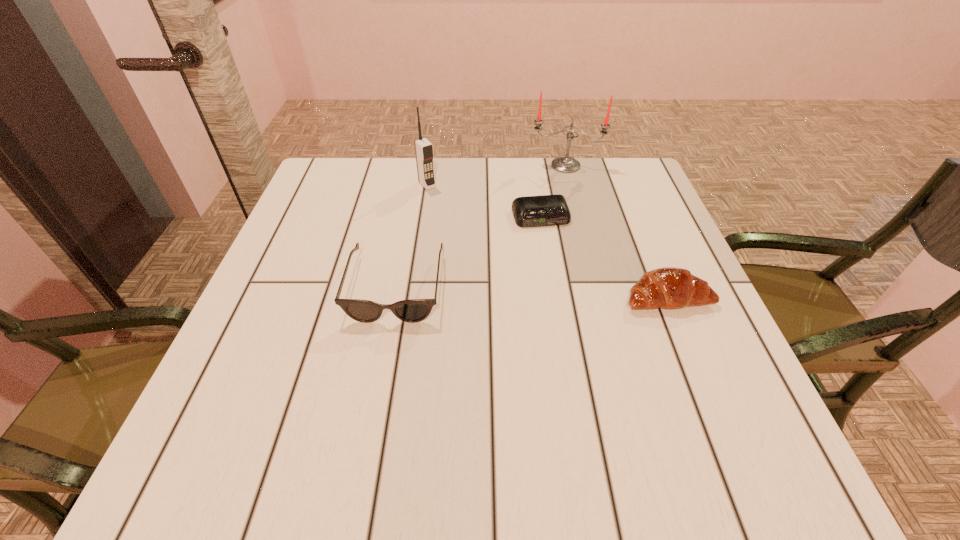
At what (x,y) coordinates should I click in order to perform the action: click on vacant space on the desktop that is between the sunglasses and the crescent roll and is positioned on the front-facing side of the fourth nearest object. Please return your answer as a coordinate pair (x, y). Looking at the image, I should click on (530, 292).

Find the location of a particular element. This screenshot has width=960, height=540. free space on the desktop that is between the sunglasses and the crescent roll and is positioned on the front-facing side of the farthest object is located at coordinates (569, 293).

Find the location of `free spot on the desktop that is between the sunglasses and the crescent roll and is positioned on the display of the alarm clock`. free spot on the desktop that is between the sunglasses and the crescent roll and is positioned on the display of the alarm clock is located at coordinates (567, 293).